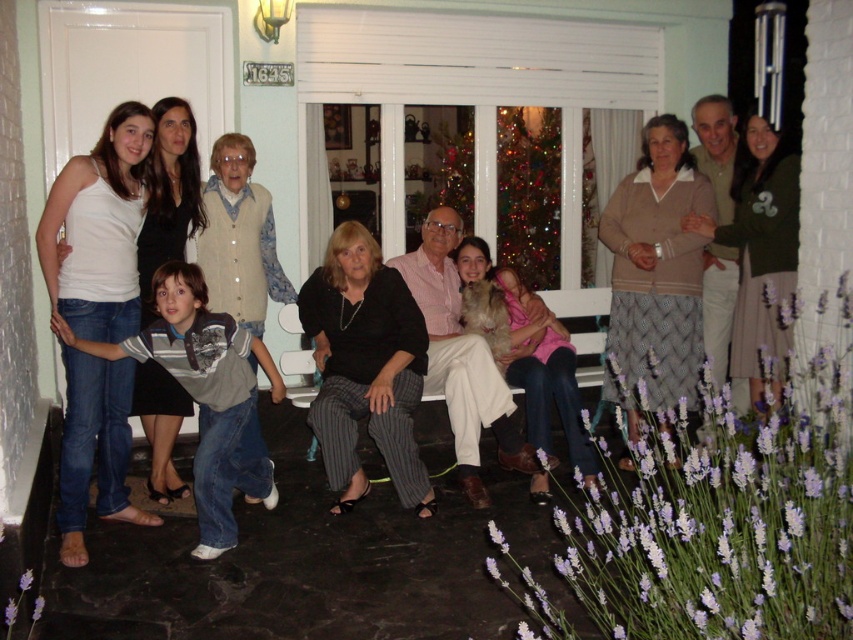
Question: Does black wool sweater at center have a lesser width compared to light beige knit vest at center?

Choices:
 (A) yes
 (B) no

Answer: (B)

Question: Which object is closer to the camera taking this photo?

Choices:
 (A) purple floral bush at lower right
 (B) light beige knit vest at center

Answer: (A)

Question: Is jeans at left wider than light beige knit vest at center?

Choices:
 (A) no
 (B) yes

Answer: (B)

Question: Is black textured pants at center bigger than black wool sweater at center?

Choices:
 (A) yes
 (B) no

Answer: (B)

Question: Which point is farther to the camera?

Choices:
 (A) (498, 413)
 (B) (555, 369)
 (C) (224, 154)
 (D) (718, 310)

Answer: (D)

Question: Estimate the real-world distances between objects in this image. Which object is farther from the matte white tank top at left?

Choices:
 (A) matte black jacket at center
 (B) black wool sweater at center
 (C) beige knit sweater at center
 (D) jeans at left

Answer: (C)